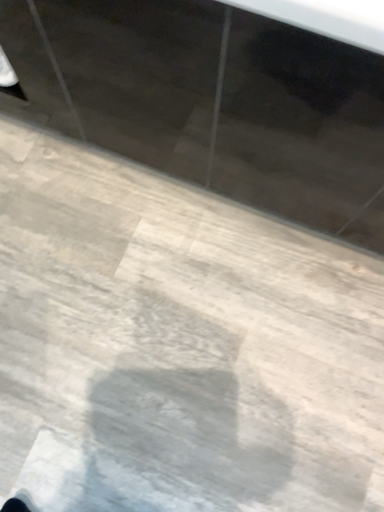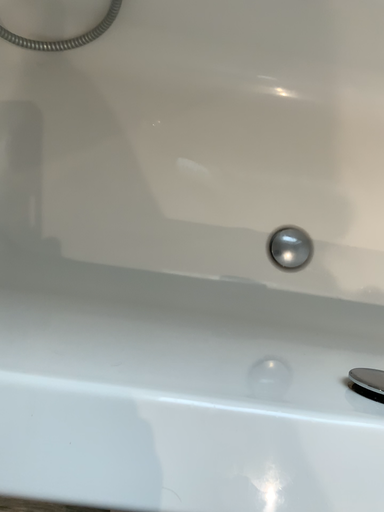
Question: Which way did the camera rotate in the video?

Choices:
 (A) rotated upward
 (B) rotated downward

Answer: (B)